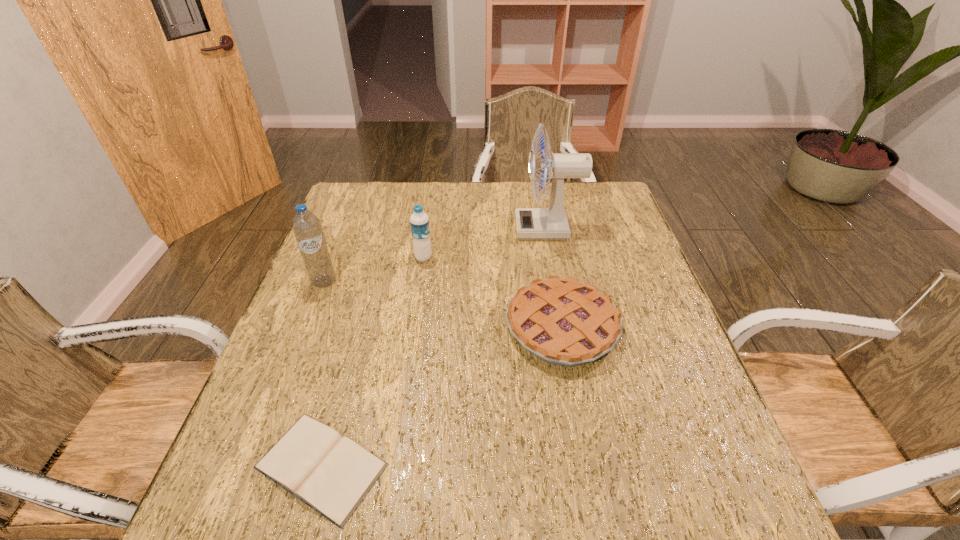
Locate an element on the screen. fan located in the right edge section of the desktop is located at coordinates (531, 223).

In order to click on pie present at the right edge in this screenshot , I will do `click(564, 322)`.

Where is `object that is at the near left corner`? The width and height of the screenshot is (960, 540). object that is at the near left corner is located at coordinates (332, 474).

This screenshot has height=540, width=960. What are the coordinates of `object present at the far right corner` in the screenshot? It's located at (531, 223).

The height and width of the screenshot is (540, 960). In order to click on free space at the far edge of the desktop in this screenshot , I will do `click(467, 211)`.

The height and width of the screenshot is (540, 960). I want to click on vacant space at the left edge, so click(x=316, y=366).

The height and width of the screenshot is (540, 960). In the image, there is a desktop. What are the coordinates of `vacant space at the right edge` in the screenshot? It's located at (636, 309).

Identify the location of vacant space at the far right corner of the desktop. This screenshot has height=540, width=960. (597, 215).

At what (x,y) coordinates should I click in order to perform the action: click on free space between the nearest object and the left water bottle. Please return your answer as a coordinate pair (x, y). This screenshot has width=960, height=540. Looking at the image, I should click on (323, 374).

Where is `unoccupied position between the farthest object and the Bible`? The image size is (960, 540). unoccupied position between the farthest object and the Bible is located at coordinates (434, 347).